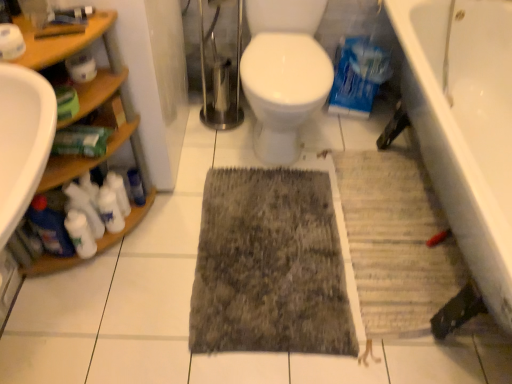
In order to click on free space that is in between white matte cleaning product at left, the 1th cleaning product from the right, and gray textured bath mat at lower right in this screenshot , I will do `click(269, 228)`.